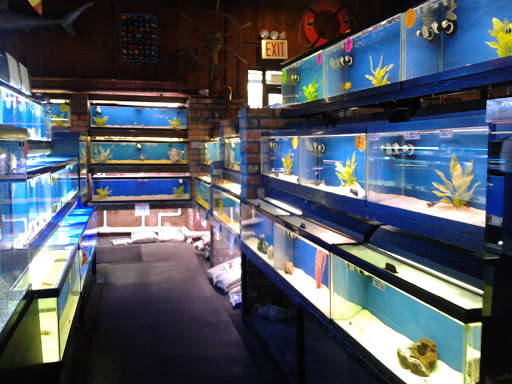
You are a GUI agent. You are given a task and a screenshot of the screen. Output one action in this format:
    pyautogui.click(x=<x>, y=<y>)
    Task: Click on the poster
    This screenshot has height=384, width=512.
    Given the screenshot: What is the action you would take?
    pyautogui.click(x=132, y=42)